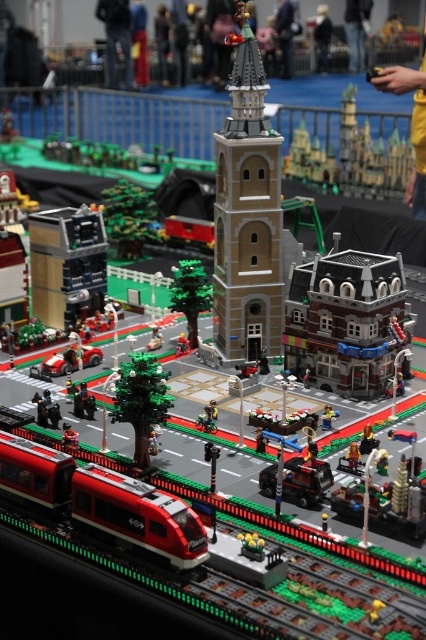
Question: Is smooth plastic train track at center thinner than shiny red train at lower left?

Choices:
 (A) no
 (B) yes

Answer: (A)

Question: Which object is farther from the camera taking this photo?

Choices:
 (A) shiny red train at lower left
 (B) smooth plastic train track at center
 (C) light brown brick tower at center

Answer: (C)

Question: Considering the relative positions of light brown brick tower at center and shiny red train at lower left in the image provided, where is light brown brick tower at center located with respect to shiny red train at lower left?

Choices:
 (A) above
 (B) below

Answer: (A)

Question: Which of the following is the farthest from the observer?

Choices:
 (A) shiny red train at lower left
 (B) smooth plastic train track at center

Answer: (A)

Question: Which of the following is the closest to the observer?

Choices:
 (A) shiny red train at lower left
 (B) light brown brick tower at center

Answer: (A)

Question: Is smooth plastic train track at center to the right of light brown brick tower at center from the viewer's perspective?

Choices:
 (A) yes
 (B) no

Answer: (B)